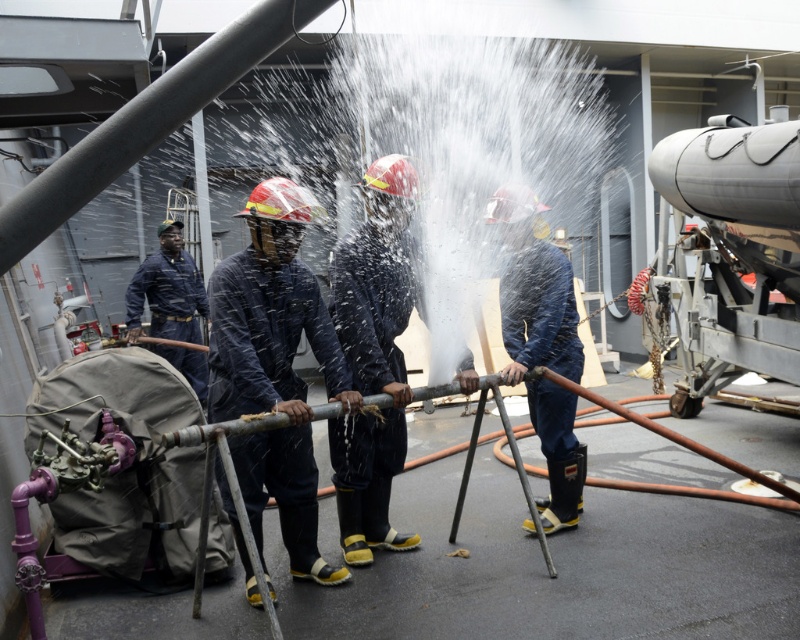
You are a maintenance worker on the ship and need to move a tool from the dark blue uniform at center to the blue rubber boots at center. Can you reach the boots without moving your position?

The distance between dark blue uniform at center and blue rubber boots at center is 1.31 meters, so you cannot reach the blue rubber boots at center without moving since the distance is too far.

You are an observer on the ship and notice the dark blue uniform at center and the blue rubber boots at center. Which object is taller?

The dark blue uniform at center is much taller as blue rubber boots at center.